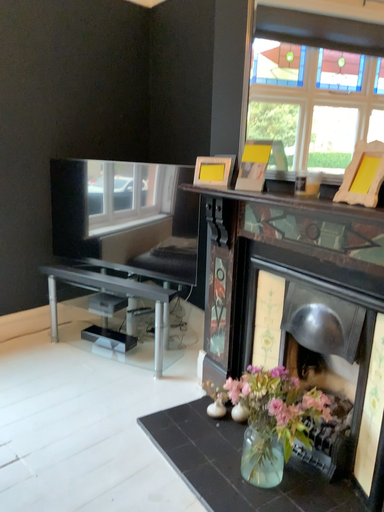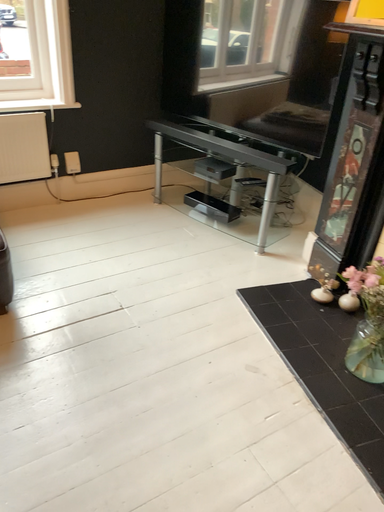
Question: Which way did the camera rotate in the video?

Choices:
 (A) rotated left
 (B) rotated right

Answer: (A)